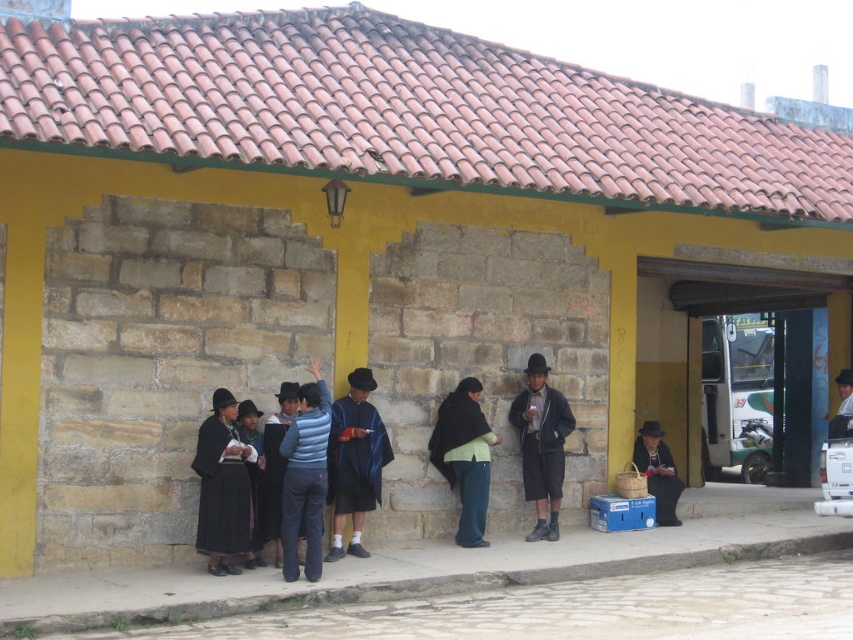
Question: Does blue striped sweater at center appear over black woolen dress at lower left?

Choices:
 (A) no
 (B) yes

Answer: (B)

Question: Which point is closer to the camera?

Choices:
 (A) blue woolen poncho at center
 (B) blue striped sweater at center
 (C) dark green fabric at center

Answer: (B)

Question: Which of the following is the farthest from the observer?

Choices:
 (A) dark brown leather hat at center
 (B) blue striped sweater at center

Answer: (A)

Question: Does dark blue sweater at center appear on the left side of black woolen dress at lower left?

Choices:
 (A) no
 (B) yes

Answer: (A)

Question: Which point is farther to the camera?

Choices:
 (A) dark blue fabric hat at center
 (B) dark brown leather hat at center
 (C) black woolen dress at lower left
 (D) black woolen dress at left

Answer: (A)

Question: Considering the relative positions of matte black hat at lower right and black woolen dress at lower left in the image provided, where is matte black hat at lower right located with respect to black woolen dress at lower left?

Choices:
 (A) left
 (B) right

Answer: (B)